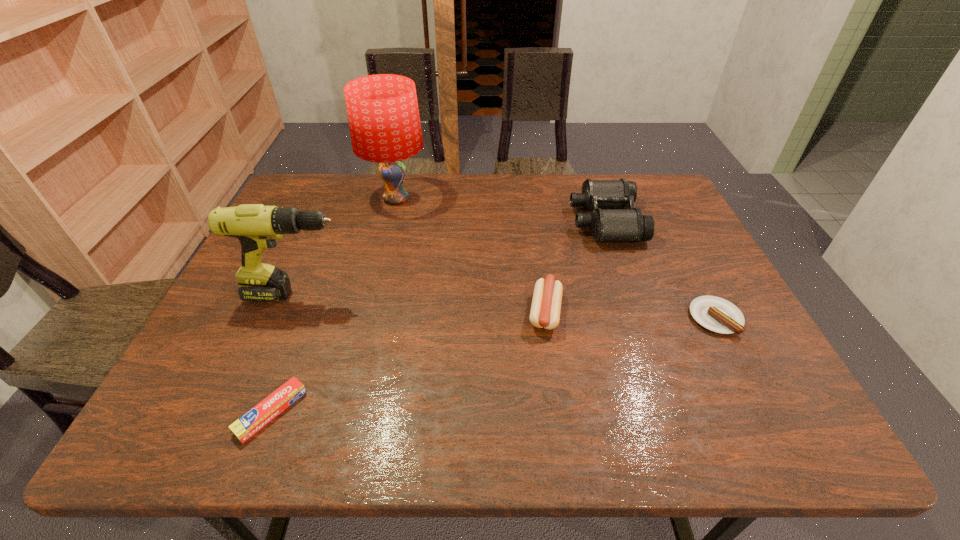
This screenshot has height=540, width=960. Identify the location of blank space located 0.230m on the front-facing side of the tallest object. (501, 199).

Image resolution: width=960 pixels, height=540 pixels. Find the location of `free space located on the handle side of the fifth shortest object`. free space located on the handle side of the fifth shortest object is located at coordinates (383, 294).

I want to click on free spot located 0.080m through the eyepieces of the binoculars, so click(545, 221).

Where is `vacant space positioned through the eyepieces of the binoculars`? vacant space positioned through the eyepieces of the binoculars is located at coordinates (541, 221).

You are a GUI agent. You are given a task and a screenshot of the screen. Output one action in this format:
    pyautogui.click(x=<x>, y=<y>)
    Task: Click on the free space located through the eyepieces of the binoculars
    This screenshot has width=960, height=540.
    Given the screenshot: What is the action you would take?
    pyautogui.click(x=494, y=221)

This screenshot has height=540, width=960. In order to click on vacant region located 0.210m on the left of the taller sausage in this screenshot , I will do `click(438, 312)`.

Identify the location of vacant area situated 0.370m on the left of the second shortest object. (530, 318).

Identify the location of vacant space located on the right of the toothpaste. The height and width of the screenshot is (540, 960). (420, 412).

Image resolution: width=960 pixels, height=540 pixels. I want to click on lampshade situated at the far edge, so click(x=383, y=114).

The width and height of the screenshot is (960, 540). Identify the location of binoculars located in the far edge section of the desktop. (609, 221).